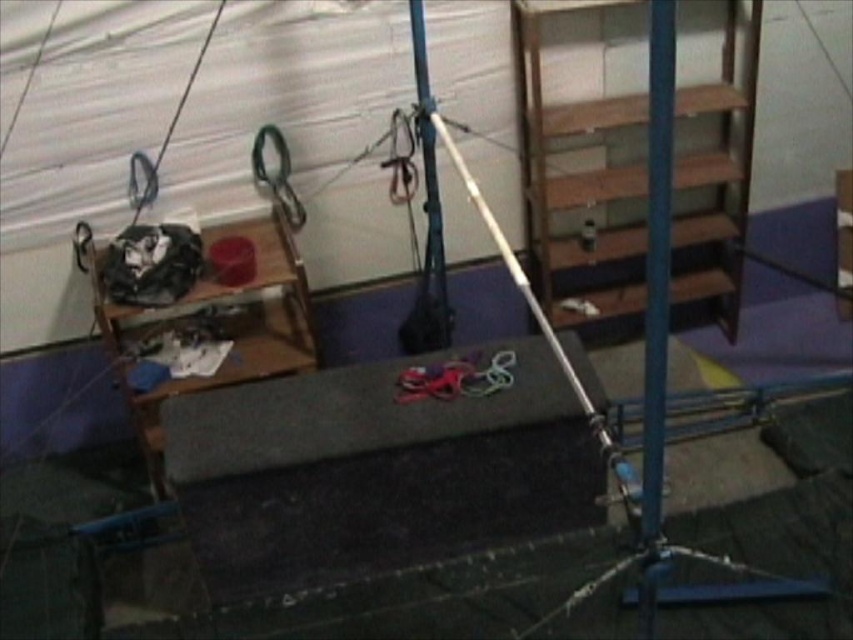
Question: Can you confirm if wooden at left is positioned to the right of blue metallic pole at center-right?

Choices:
 (A) no
 (B) yes

Answer: (A)

Question: Which point is closer to the camera taking this photo?

Choices:
 (A) (416, 16)
 (B) (256, 310)
 (C) (666, 72)

Answer: (C)

Question: Observing the image, what is the correct spatial positioning of blue metallic pole at center-right in reference to blue metallic pole at center?

Choices:
 (A) right
 (B) left

Answer: (A)

Question: Does wooden at left have a larger size compared to blue metallic pole at center-right?

Choices:
 (A) no
 (B) yes

Answer: (B)

Question: Which object is the farthest from the blue metallic pole at center-right?

Choices:
 (A) blue metallic pole at center
 (B) wooden at left

Answer: (B)

Question: Which object is closer to the camera taking this photo?

Choices:
 (A) blue metallic pole at center-right
 (B) blue metallic pole at center
 (C) wooden at left

Answer: (A)